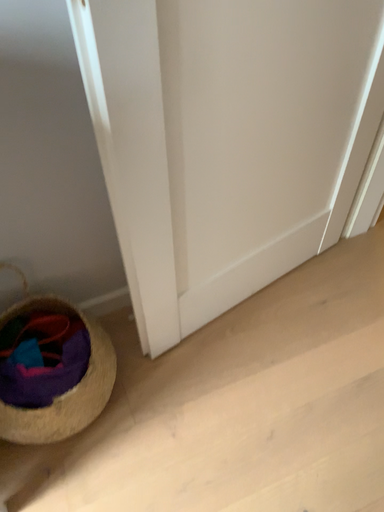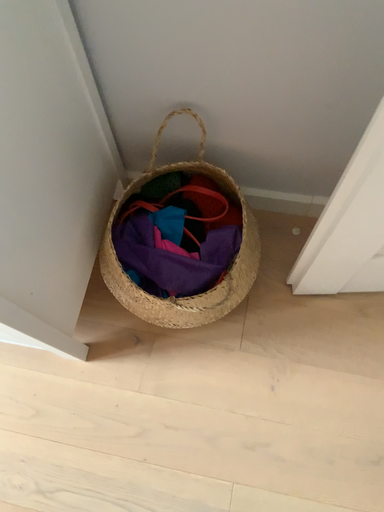
Question: Which way did the camera rotate in the video?

Choices:
 (A) rotated upward
 (B) rotated downward

Answer: (B)